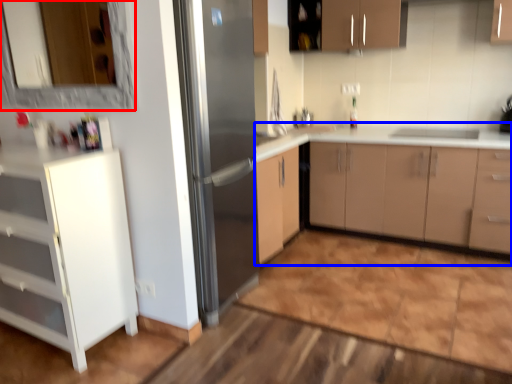
Question: Which point is further to the camera, mirror (highlighted by a red box) or cabinetry (highlighted by a blue box)?

Choices:
 (A) mirror
 (B) cabinetry

Answer: (B)